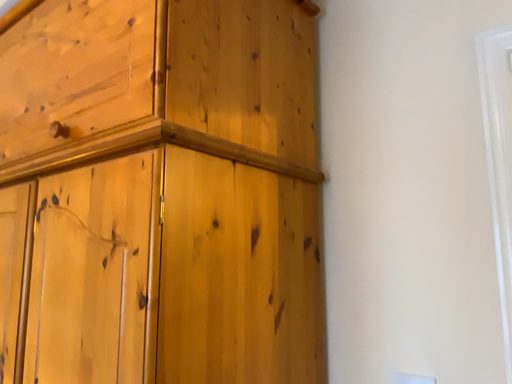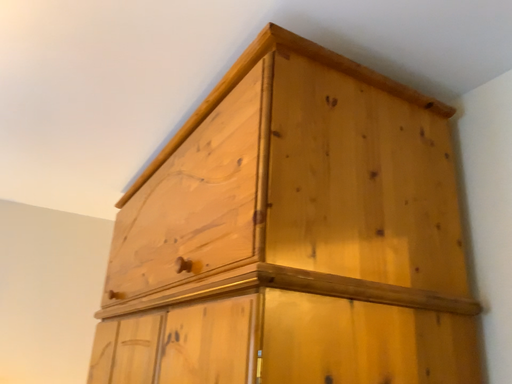
Question: Which way did the camera rotate in the video?

Choices:
 (A) rotated right
 (B) rotated left

Answer: (B)